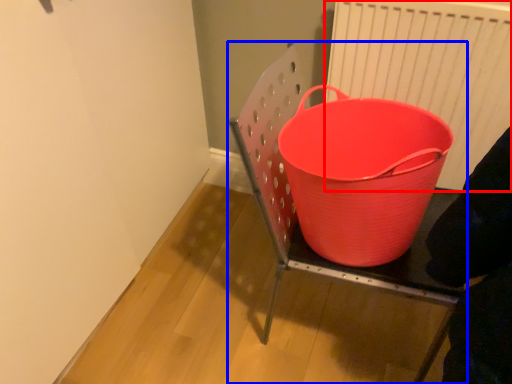
Question: Which object is closer to the camera taking this photo, radiator (highlighted by a red box) or furniture (highlighted by a blue box)?

Choices:
 (A) radiator
 (B) furniture

Answer: (B)